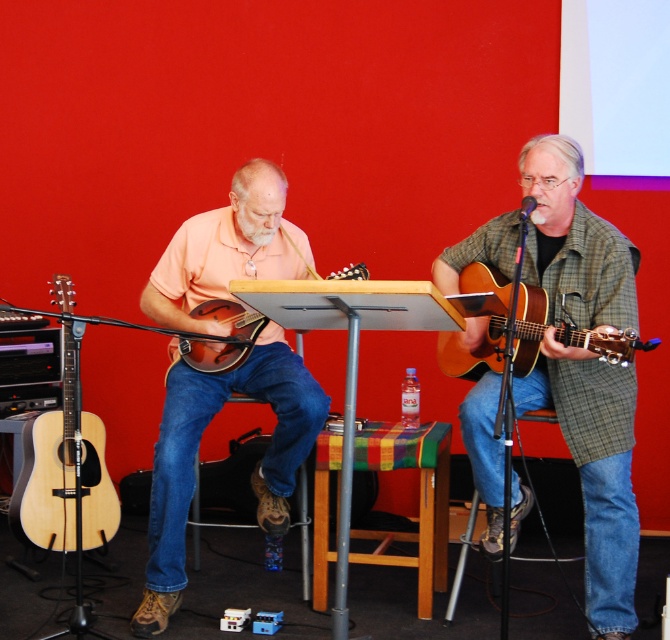
You are a photographer positioned in front of the two guitarists. You want to take a clear photo of the natural wood acoustic guitar at left without the acoustic wood guitar at right blocking it. Is this possible given their positions?

Yes, since the natural wood acoustic guitar at left is closer to you than the acoustic wood guitar at right, you can take a clear photo of the natural wood acoustic guitar at left without the acoustic wood guitar at right blocking it by focusing on the closer guitar.

You are a photographer standing in front of the two musicians. You want to take a photo that includes both the mandolin player and the guitar player. If you move your camera slightly to the right, will the point closer to the camera become the one at position point (551, 157) or point (50, 496)?

The point closer to the camera is point (551, 157), so moving the camera to the right won t change their relative distances. The point closer to the camera remains point (551, 157).